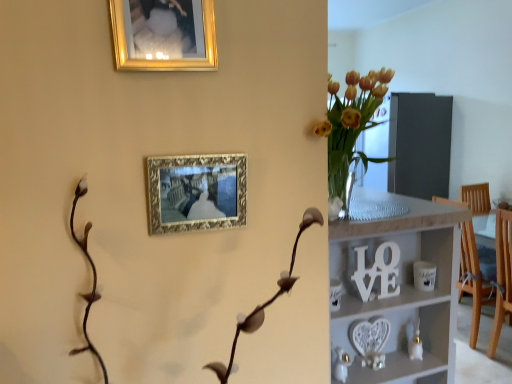
Question: Is white wooden shelf at center positioned in front of gold ornate picture frame at upper center, which ranks as the 1th picture frame in bottom-to-top order?

Choices:
 (A) no
 (B) yes

Answer: (A)

Question: Is white wooden shelf at center facing towards gold ornate picture frame at upper center, the second picture frame viewed from the top?

Choices:
 (A) no
 (B) yes

Answer: (A)

Question: From the image's perspective, is white wooden shelf at center under gold ornate picture frame at upper center, the second picture frame viewed from the top?

Choices:
 (A) no
 (B) yes

Answer: (B)

Question: Is the surface of white wooden shelf at center in direct contact with gold ornate picture frame at upper center, the second picture frame viewed from the top?

Choices:
 (A) yes
 (B) no

Answer: (B)

Question: Considering the relative positions of white wooden shelf at center and gold ornate picture frame at upper center, which ranks as the 1th picture frame in bottom-to-top order, in the image provided, is white wooden shelf at center to the left of gold ornate picture frame at upper center, which ranks as the 1th picture frame in bottom-to-top order, from the viewer's perspective?

Choices:
 (A) yes
 (B) no

Answer: (B)

Question: In terms of height, does white wooden shelf at center look taller or shorter compared to gold metallic picture frame at upper center, which is the second picture frame from bottom to top?

Choices:
 (A) tall
 (B) short

Answer: (A)

Question: In the image, is white wooden shelf at center positioned in front of or behind gold metallic picture frame at upper center, which is the second picture frame from bottom to top?

Choices:
 (A) front
 (B) behind

Answer: (B)

Question: Is point (366, 236) positioned closer to the camera than point (205, 1)?

Choices:
 (A) farther
 (B) closer

Answer: (A)

Question: From the image's perspective, is white wooden shelf at center located above or below gold metallic picture frame at upper center, which is the second picture frame from bottom to top?

Choices:
 (A) below
 (B) above

Answer: (A)

Question: From the image's perspective, is gold metallic picture frame at upper center, which is the second picture frame from bottom to top, positioned above or below white wooden shelf at center?

Choices:
 (A) above
 (B) below

Answer: (A)

Question: Relative to white wooden shelf at center, is gold metallic picture frame at upper center, which is the second picture frame from bottom to top, in front or behind?

Choices:
 (A) behind
 (B) front

Answer: (B)

Question: Is gold metallic picture frame at upper center, the first picture frame in the top-to-bottom sequence, to the left or to the right of white wooden shelf at center in the image?

Choices:
 (A) left
 (B) right

Answer: (A)

Question: Looking at the image, does gold metallic picture frame at upper center, which is the second picture frame from bottom to top, seem bigger or smaller compared to white wooden shelf at center?

Choices:
 (A) big
 (B) small

Answer: (B)

Question: Is gold ornate picture frame at upper center, which ranks as the 1th picture frame in bottom-to-top order, inside or outside of gold metallic picture frame at upper center, which is the second picture frame from bottom to top?

Choices:
 (A) outside
 (B) inside

Answer: (A)

Question: From a real-world perspective, is gold ornate picture frame at upper center, the second picture frame viewed from the top, positioned above or below gold metallic picture frame at upper center, which is the second picture frame from bottom to top?

Choices:
 (A) below
 (B) above

Answer: (A)